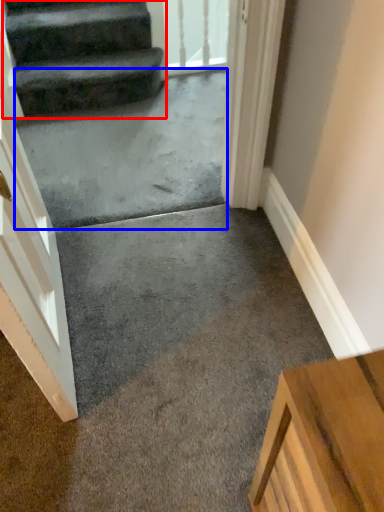
Question: Which point is further to the camera, stairs (highlighted by a red box) or concrete (highlighted by a blue box)?

Choices:
 (A) stairs
 (B) concrete

Answer: (A)